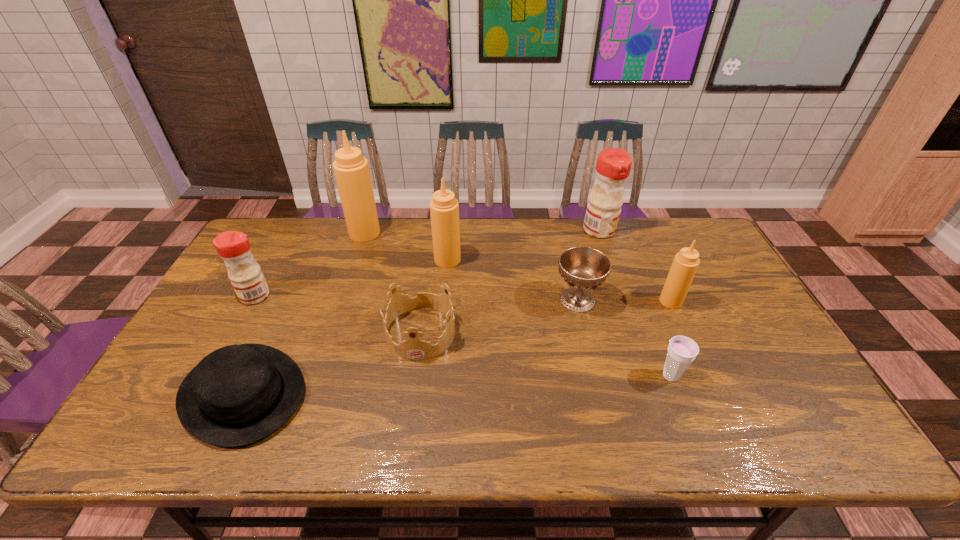
This screenshot has height=540, width=960. I want to click on vacant space at the left edge of the desktop, so click(269, 265).

At what (x,y) coordinates should I click in order to perform the action: click on vacant space at the near left corner of the desktop. Please return your answer as a coordinate pair (x, y). The image size is (960, 540). Looking at the image, I should click on (158, 437).

Find the location of a particular element. vacant space at the far right corner of the desktop is located at coordinates (705, 240).

This screenshot has width=960, height=540. What are the coordinates of `free space between the right red condiment and the second farthest tan condiment` in the screenshot? It's located at (523, 245).

The image size is (960, 540). Identify the location of free space between the farthest tan condiment and the black fedora. (304, 313).

In order to click on vacant region between the fourth condiment from left to right and the black fedora in this screenshot , I will do `click(421, 312)`.

Identify the location of free space between the third nearest condiment and the smallest tan condiment. (559, 280).

The height and width of the screenshot is (540, 960). I want to click on blank region between the cup and the left red condiment, so click(x=463, y=336).

Locate an element on the screen. free space that is in between the seventh nearest object and the farther red condiment is located at coordinates [x=523, y=245].

At what (x,y) coordinates should I click in order to perform the action: click on free space between the fourth condiment from left to right and the second tan condiment from right to left. Please return your answer as a coordinate pair (x, y). Looking at the image, I should click on (523, 245).